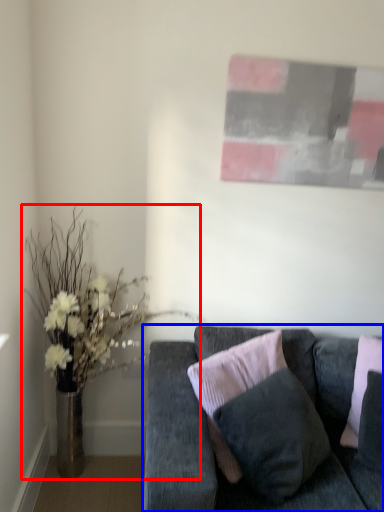
Question: Which object appears closest to the camera in this image, houseplant (highlighted by a red box) or studio couch (highlighted by a blue box)?

Choices:
 (A) houseplant
 (B) studio couch

Answer: (B)